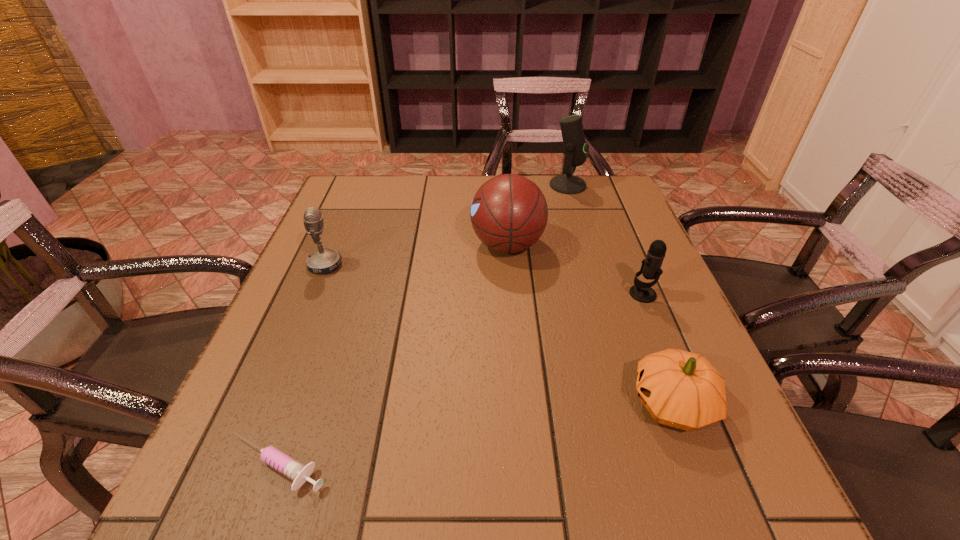
Choose which object is the nearest neighbor to the gourd. Please provide its 2D coordinates. Your answer should be formatted as a tuple, i.e. [(x, y)], where the tuple contains the x and y coordinates of a point satisfying the conditions above.

[(651, 269)]

Where is `the second closest microphone to the gourd`? Image resolution: width=960 pixels, height=540 pixels. the second closest microphone to the gourd is located at coordinates (575, 148).

The width and height of the screenshot is (960, 540). In order to click on microphone that is the nearest to the fourth farthest object in this screenshot , I will do `click(575, 148)`.

Identify the location of free region that satisfies the following two spatial constraints: 1. on the back side of the shortest object; 2. on the right side of the basketball. Image resolution: width=960 pixels, height=540 pixels. (355, 245).

Identify the location of free spot that satisfies the following two spatial constraints: 1. on the back side of the shortest object; 2. on the right side of the fourth farthest object. (338, 294).

The width and height of the screenshot is (960, 540). Find the location of `vacant space that satisfies the following two spatial constraints: 1. on the front-facing side of the syringe; 2. on the left side of the second farthest microphone`. vacant space that satisfies the following two spatial constraints: 1. on the front-facing side of the syringe; 2. on the left side of the second farthest microphone is located at coordinates (241, 465).